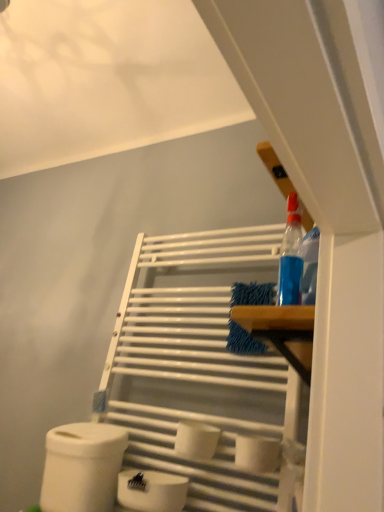
Where is `white matte toilet paper at center, which is the 1th toilet paper from right to left`? white matte toilet paper at center, which is the 1th toilet paper from right to left is located at coordinates (257, 453).

Measure the distance between point (113, 425) and camera.

The distance of point (113, 425) from camera is 4.77 feet.

What do you see at coordinates (196, 440) in the screenshot?
I see `white matte toilet paper at center, which is counted as the second toilet paper, starting from the right` at bounding box center [196, 440].

How much space does white matte toilet paper at center, which is the third toilet paper in left-to-right order, occupy horizontally?

4.76 inches.

Find the location of a particular element. The width and height of the screenshot is (384, 512). white matte toilet paper at center, which ranks as the 4th toilet paper in left-to-right order is located at coordinates (257, 453).

Is point (64, 504) positioned after point (239, 268)?

That is False.

Who is shorter, white matte toilet paper at lower left, the 1th toilet paper viewed from the left, or white matte towel rack at upper center?

Standing shorter between the two is white matte toilet paper at lower left, the 1th toilet paper viewed from the left.

Does white matte toilet paper at lower left, the 1th toilet paper viewed from the left, contain white matte towel rack at upper center?

No, white matte towel rack at upper center is not inside white matte toilet paper at lower left, the 1th toilet paper viewed from the left.

Which of these two, white matte toilet paper at lower left, which is the 4th toilet paper from right to left, or white matte towel rack at upper center, is smaller?

white matte toilet paper at lower left, which is the 4th toilet paper from right to left.

How many degrees apart are the facing directions of blue microfiber cloth at center and white matte toilet paper at center, which is counted as the second toilet paper, starting from the right?

1.48 degrees separate the facing orientations of blue microfiber cloth at center and white matte toilet paper at center, which is counted as the second toilet paper, starting from the right.

Visually, is blue microfiber cloth at center positioned to the left or to the right of white matte toilet paper at center, which is the third toilet paper in left-to-right order?

Clearly, blue microfiber cloth at center is on the right of white matte toilet paper at center, which is the third toilet paper in left-to-right order, in the image.

Can you confirm if blue microfiber cloth at center is shorter than white matte toilet paper at center, which is the third toilet paper in left-to-right order?

In fact, blue microfiber cloth at center may be taller than white matte toilet paper at center, which is the third toilet paper in left-to-right order.

Between blue microfiber cloth at center and white matte toilet paper at center, which is counted as the second toilet paper, starting from the right, which one has larger width?

white matte toilet paper at center, which is counted as the second toilet paper, starting from the right, is wider.

From the image's perspective, between white matte towel rack at upper center and white matte toilet paper at lower center, positioned as the second toilet paper in left-to-right order, who is located below?

white matte toilet paper at lower center, positioned as the second toilet paper in left-to-right order.

Is there a large distance between white matte towel rack at upper center and white matte toilet paper at lower center, the 3th toilet paper in the right-to-left sequence?

No, white matte towel rack at upper center is not far from white matte toilet paper at lower center, the 3th toilet paper in the right-to-left sequence.

Considering the relative sizes of white matte towel rack at upper center and white matte toilet paper at lower center, positioned as the second toilet paper in left-to-right order, in the image provided, is white matte towel rack at upper center taller than white matte toilet paper at lower center, positioned as the second toilet paper in left-to-right order,?

Indeed, white matte towel rack at upper center has a greater height compared to white matte toilet paper at lower center, positioned as the second toilet paper in left-to-right order.

Could you measure the distance between white matte towel rack at upper center and white matte toilet paper at lower center, positioned as the second toilet paper in left-to-right order?

The distance of white matte towel rack at upper center from white matte toilet paper at lower center, positioned as the second toilet paper in left-to-right order, is 15.35 inches.

Can you confirm if white matte toilet paper at lower center, positioned as the second toilet paper in left-to-right order, is smaller than white matte towel rack at upper center?

Yes, white matte toilet paper at lower center, positioned as the second toilet paper in left-to-right order, is smaller than white matte towel rack at upper center.

Considering the sizes of objects white matte toilet paper at lower center, the 3th toilet paper in the right-to-left sequence, and white matte towel rack at upper center in the image provided, who is wider, white matte toilet paper at lower center, the 3th toilet paper in the right-to-left sequence, or white matte towel rack at upper center?

Wider between the two is white matte toilet paper at lower center, the 3th toilet paper in the right-to-left sequence.

Is the depth of white matte toilet paper at lower center, positioned as the second toilet paper in left-to-right order, less than that of white matte towel rack at upper center?

No, it is behind white matte towel rack at upper center.

Is white matte toilet paper at lower center, the 3th toilet paper in the right-to-left sequence, completely or partially outside of white matte towel rack at upper center?

Yes, white matte toilet paper at lower center, the 3th toilet paper in the right-to-left sequence, is located beyond the bounds of white matte towel rack at upper center.

From a real-world perspective, is white matte toilet paper at lower center, positioned as the second toilet paper in left-to-right order, physically located above or below white matte toilet paper at center, which is counted as the second toilet paper, starting from the right?

Clearly, from a real-world perspective, white matte toilet paper at lower center, positioned as the second toilet paper in left-to-right order, is below white matte toilet paper at center, which is counted as the second toilet paper, starting from the right.

Considering the positions of point (176, 509) and point (202, 449), is point (176, 509) closer or farther from the camera than point (202, 449)?

Point (176, 509) is closer to the camera than point (202, 449).

Can you confirm if white matte toilet paper at lower center, positioned as the second toilet paper in left-to-right order, is wider than white matte toilet paper at center, which is counted as the second toilet paper, starting from the right?

No.

Is white matte toilet paper at lower center, positioned as the second toilet paper in left-to-right order, to the left of white matte toilet paper at center, which is counted as the second toilet paper, starting from the right, from the viewer's perspective?

Yes, white matte toilet paper at lower center, positioned as the second toilet paper in left-to-right order, is to the left of white matte toilet paper at center, which is counted as the second toilet paper, starting from the right.

Which is more to the left, white matte toilet paper at lower center, positioned as the second toilet paper in left-to-right order, or blue microfiber cloth at center?

white matte toilet paper at lower center, positioned as the second toilet paper in left-to-right order, is more to the left.

Does point (169, 474) lie in front of point (252, 290)?

No, it is not.

From a real-world perspective, is white matte toilet paper at lower center, positioned as the second toilet paper in left-to-right order, located higher than blue microfiber cloth at center?

No, from a real-world perspective, white matte toilet paper at lower center, positioned as the second toilet paper in left-to-right order, is not above blue microfiber cloth at center.

Is white matte toilet paper at lower center, positioned as the second toilet paper in left-to-right order, inside the boundaries of blue microfiber cloth at center, or outside?

white matte toilet paper at lower center, positioned as the second toilet paper in left-to-right order, exists outside the volume of blue microfiber cloth at center.

Does blue microfiber cloth at center have a greater height compared to white matte toilet paper at lower center, the 3th toilet paper in the right-to-left sequence?

Yes.

Could you tell me if blue microfiber cloth at center is facing white matte toilet paper at lower center, positioned as the second toilet paper in left-to-right order?

No, blue microfiber cloth at center is not oriented towards white matte toilet paper at lower center, positioned as the second toilet paper in left-to-right order.

Is blue microfiber cloth at center touching white matte toilet paper at lower center, the 3th toilet paper in the right-to-left sequence?

No, blue microfiber cloth at center is not making contact with white matte toilet paper at lower center, the 3th toilet paper in the right-to-left sequence.

Find the location of a particular element. the 4th toilet paper behind when counting from the white matte towel rack at upper center is located at coordinates (82, 467).

The height and width of the screenshot is (512, 384). In order to click on the 2nd toilet paper positioned below the blue microfiber cloth at center (from the image's perspective) in this screenshot , I will do `click(196, 440)`.

Based on their spatial positions, is white matte toilet paper at lower center, positioned as the second toilet paper in left-to-right order, or white matte toilet paper at lower left, the 1th toilet paper viewed from the left, closer to blue microfiber cloth at center?

Among the two, white matte toilet paper at lower center, positioned as the second toilet paper in left-to-right order, is located nearer to blue microfiber cloth at center.

Which object lies further to the anchor point blue microfiber cloth at center, white matte toilet paper at lower left, which is the 4th toilet paper from right to left, or white matte towel rack at upper center?

white matte toilet paper at lower left, which is the 4th toilet paper from right to left, lies further to blue microfiber cloth at center than the other object.

Considering their positions, is white matte towel rack at upper center positioned further to white matte toilet paper at lower center, positioned as the second toilet paper in left-to-right order, than blue microfiber cloth at center?

Based on the image, blue microfiber cloth at center appears to be further to white matte toilet paper at lower center, positioned as the second toilet paper in left-to-right order.

Based on their spatial positions, is white matte toilet paper at lower center, the 3th toilet paper in the right-to-left sequence, or white matte toilet paper at center, which ranks as the 4th toilet paper in left-to-right order, closer to white matte toilet paper at center, which is the third toilet paper in left-to-right order?

white matte toilet paper at center, which ranks as the 4th toilet paper in left-to-right order, is closer to white matte toilet paper at center, which is the third toilet paper in left-to-right order.

Considering their positions, is white matte toilet paper at lower center, the 3th toilet paper in the right-to-left sequence, positioned further to blue microfiber cloth at center than white matte towel rack at upper center?

white matte toilet paper at lower center, the 3th toilet paper in the right-to-left sequence, lies further to blue microfiber cloth at center than the other object.

Looking at the image, which one is located closer to white matte towel rack at upper center, white matte toilet paper at lower center, the 3th toilet paper in the right-to-left sequence, or white matte toilet paper at lower left, the 1th toilet paper viewed from the left?

white matte toilet paper at lower left, the 1th toilet paper viewed from the left, is closer to white matte towel rack at upper center.

Considering their positions, is white matte toilet paper at lower left, which is the 4th toilet paper from right to left, positioned closer to blue microfiber cloth at center than white matte toilet paper at lower center, the 3th toilet paper in the right-to-left sequence?

white matte toilet paper at lower center, the 3th toilet paper in the right-to-left sequence, lies closer to blue microfiber cloth at center than the other object.

Looking at the image, which one is located further to white matte toilet paper at center, which is the 1th toilet paper from right to left, white matte toilet paper at lower left, which is the 4th toilet paper from right to left, or blue microfiber cloth at center?

The object further to white matte toilet paper at center, which is the 1th toilet paper from right to left, is white matte toilet paper at lower left, which is the 4th toilet paper from right to left.

Find the location of `toilet paper between blue microfiber cloth at center and white matte toilet paper at center, which is counted as the second toilet paper, starting from the right, vertically`. toilet paper between blue microfiber cloth at center and white matte toilet paper at center, which is counted as the second toilet paper, starting from the right, vertically is located at coordinates (257, 453).

I want to click on shelf located between white matte toilet paper at lower left, the 1th toilet paper viewed from the left, and white matte toilet paper at center, which is the third toilet paper in left-to-right order, in the left-right direction, so click(x=200, y=365).

At what (x,y) coordinates should I click in order to perform the action: click on shelf between white matte toilet paper at lower left, the 1th toilet paper viewed from the left, and blue microfiber cloth at center from left to right. Please return your answer as a coordinate pair (x, y). The width and height of the screenshot is (384, 512). Looking at the image, I should click on (200, 365).

This screenshot has width=384, height=512. I want to click on shelf between blue microfiber cloth at center and white matte toilet paper at center, which is the 1th toilet paper from right to left, from top to bottom, so click(x=200, y=365).